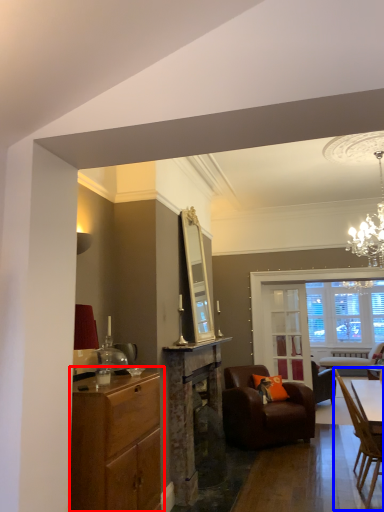
Question: Among these objects, which one is farthest to the camera, cabinetry (highlighted by a red box) or chair (highlighted by a blue box)?

Choices:
 (A) cabinetry
 (B) chair

Answer: (B)